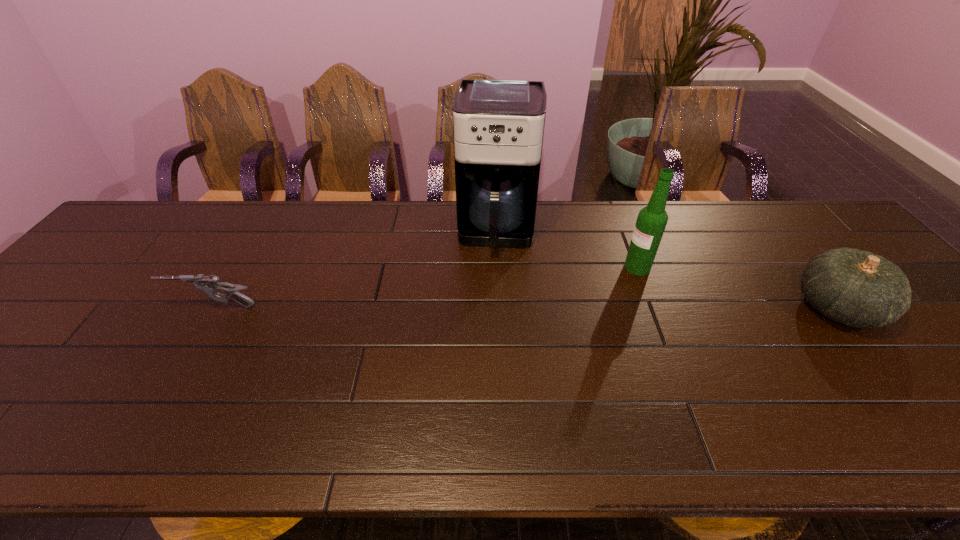
Where is `free spot on the desktop that is between the shortest object and the rightmost object and is positioned on the front panel of the second object from left to right`? Image resolution: width=960 pixels, height=540 pixels. free spot on the desktop that is between the shortest object and the rightmost object and is positioned on the front panel of the second object from left to right is located at coordinates pyautogui.click(x=491, y=308).

Where is `free space on the desktop that is between the leftmost object and the gourd and is positioned on the label of the second tallest object`? This screenshot has height=540, width=960. free space on the desktop that is between the leftmost object and the gourd and is positioned on the label of the second tallest object is located at coordinates (576, 308).